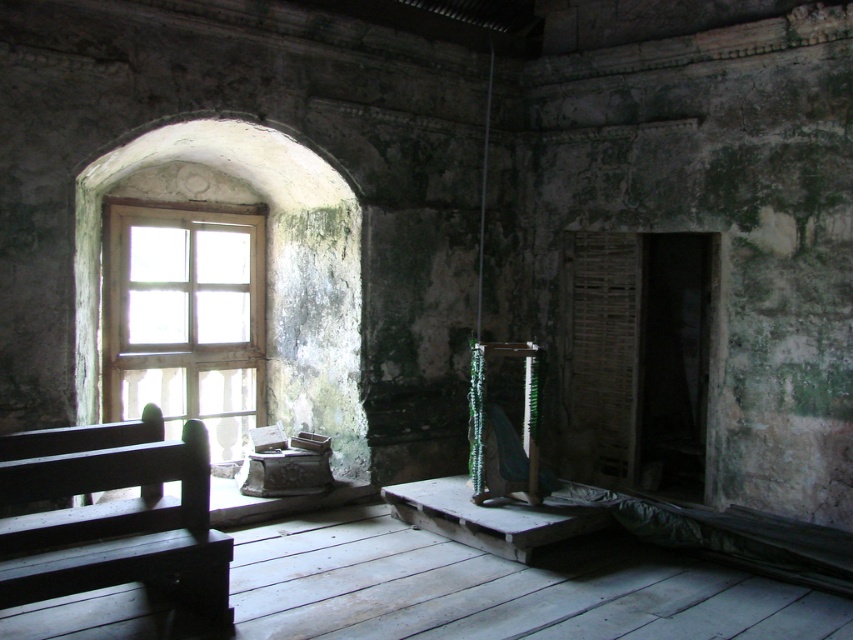
You are a painter who needs to place a 2m tall easel in this scene. Given the dark wood bench at left and the wooden at left, which object can the easel be placed next to without blocking the light from the arched window?

The dark wood bench at left is not as tall as wooden at left, so placing the 2m tall easel next to the dark wood bench at left would be better to avoid blocking the light from the arched window.

You are an interior designer planning to place a 1.5 meter wide sofa in this old building. You see the dark wood bench at left and the wooden at left. Which object has a wider width to accommodate the sofa?

The dark wood bench at left has a wider width than the wooden at left, so it can accommodate the 1.5 meter wide sofa.